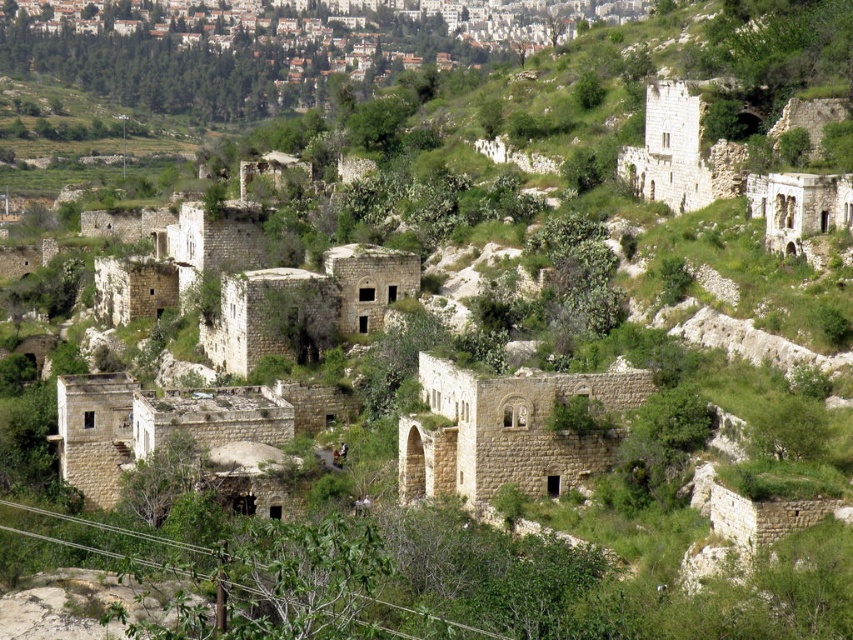
Question: Among these points, which one is farthest from the camera?

Choices:
 (A) (627, 376)
 (B) (837, 196)

Answer: (B)

Question: Is beige stone ruins at center thinner than stone archway at upper right?

Choices:
 (A) yes
 (B) no

Answer: (B)

Question: Among these objects, which one is nearest to the camera?

Choices:
 (A) beige stone ruins at center
 (B) stone archway at upper right
 (C) stone ruins at upper center

Answer: (A)

Question: Among these points, which one is farthest from the camera?

Choices:
 (A) (431, 452)
 (B) (674, 193)
 (C) (561, 35)

Answer: (C)

Question: Does stone ruins at upper center have a smaller size compared to stone archway at upper right?

Choices:
 (A) yes
 (B) no

Answer: (B)

Question: Does stone ruins at upper center have a greater width compared to stone archway at upper right?

Choices:
 (A) no
 (B) yes

Answer: (B)